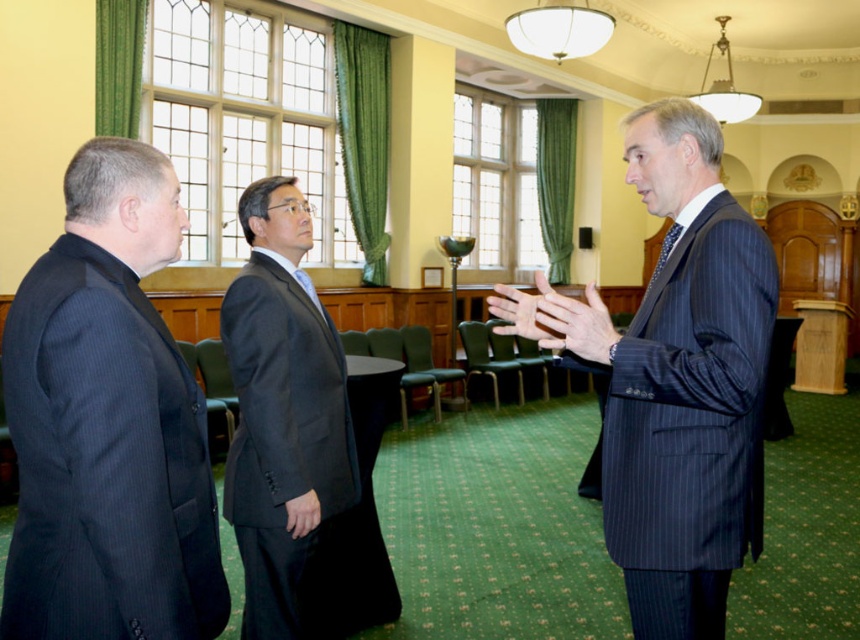
Does dark pinstripe suit at left have a greater width compared to pinstriped suit at center?

No, dark pinstripe suit at left is not wider than pinstriped suit at center.

Is dark pinstripe suit at left smaller than pinstriped suit at center?

Indeed, dark pinstripe suit at left has a smaller size compared to pinstriped suit at center.

Where is `dark pinstripe suit at left`? The height and width of the screenshot is (640, 860). dark pinstripe suit at left is located at coordinates (108, 422).

Where is `dark pinstripe suit at left`? The image size is (860, 640). dark pinstripe suit at left is located at coordinates (108, 422).

In the scene shown: How much distance is there between pinstriped suit at center and dark gray suit at center?

pinstriped suit at center is 4.12 feet from dark gray suit at center.

Consider the image. Which is below, pinstriped suit at center or dark gray suit at center?

Positioned lower is dark gray suit at center.

Locate an element on the screen. The image size is (860, 640). pinstriped suit at center is located at coordinates (674, 380).

The image size is (860, 640). Find the location of `pinstriped suit at center`. pinstriped suit at center is located at coordinates (674, 380).

Is dark pinstripe suit at left smaller than dark gray suit at center?

Yes.

Who is more distant from viewer, (60, 476) or (293, 307)?

The point (293, 307) is behind.

Does point (226, 604) come farther from viewer compared to point (268, 518)?

No, it is not.

I want to click on dark pinstripe suit at left, so click(x=108, y=422).